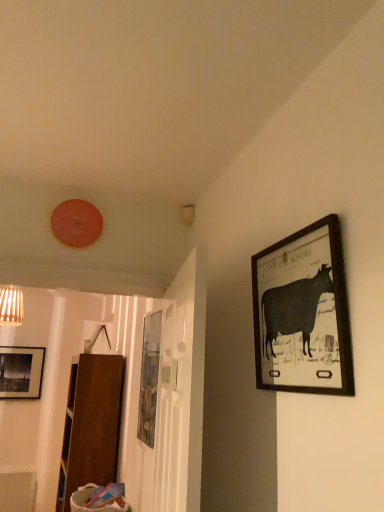
Question: Is matte black picture frame at upper right, the second picture frame from the left, oriented towards matte wooden picture frame at center, the first picture frame positioned from the back?

Choices:
 (A) yes
 (B) no

Answer: (B)

Question: From the image's perspective, is matte black picture frame at upper right, the second picture frame from the left, on top of matte wooden picture frame at center, which is the 2th picture frame from right to left?

Choices:
 (A) yes
 (B) no

Answer: (A)

Question: Considering the relative sizes of matte black picture frame at upper right, marked as the second picture frame in a back-to-front arrangement, and matte wooden picture frame at center, the 2th picture frame from the top, in the image provided, is matte black picture frame at upper right, marked as the second picture frame in a back-to-front arrangement, taller than matte wooden picture frame at center, the 2th picture frame from the top,?

Choices:
 (A) no
 (B) yes

Answer: (A)

Question: Is the position of matte black picture frame at upper right, marked as the second picture frame in a back-to-front arrangement, less distant than that of matte wooden picture frame at center, the first picture frame positioned from the back?

Choices:
 (A) no
 (B) yes

Answer: (B)

Question: From the image's perspective, does matte black picture frame at upper right, positioned as the 1th picture frame in top-to-bottom order, appear lower than matte wooden picture frame at center, which appears as the first picture frame when ordered from the bottom?

Choices:
 (A) yes
 (B) no

Answer: (B)

Question: Does matte black picture frame at upper right, positioned as the 1th picture frame in front-to-back order, have a lesser width compared to matte wooden picture frame at center, the first picture frame in the left-to-right sequence?

Choices:
 (A) no
 (B) yes

Answer: (B)

Question: From a real-world perspective, is matte wooden picture frame at center, which is the 2th picture frame from right to left, under matte black picture frame at upper right, acting as the 1th picture frame starting from the right?

Choices:
 (A) yes
 (B) no

Answer: (A)

Question: Can you confirm if matte wooden picture frame at center, the first picture frame positioned from the back, is shorter than matte black picture frame at upper right, acting as the 1th picture frame starting from the right?

Choices:
 (A) no
 (B) yes

Answer: (A)

Question: Does matte wooden picture frame at center, the 2th picture frame from the top, have a greater width compared to matte black picture frame at upper right, acting as the 1th picture frame starting from the right?

Choices:
 (A) no
 (B) yes

Answer: (B)

Question: Is the depth of matte wooden picture frame at center, which appears as the first picture frame when ordered from the bottom, greater than that of matte black picture frame at upper right, acting as the 1th picture frame starting from the right?

Choices:
 (A) yes
 (B) no

Answer: (A)

Question: Is matte wooden picture frame at center, the first picture frame positioned from the back, looking in the opposite direction of matte black picture frame at upper right, the second picture frame from the left?

Choices:
 (A) yes
 (B) no

Answer: (B)

Question: Is matte wooden picture frame at center, the 2th picture frame from the top, taller than matte black picture frame at upper right, positioned as the 1th picture frame in front-to-back order?

Choices:
 (A) yes
 (B) no

Answer: (A)

Question: Would you say matte wooden picture frame at center, which appears as the first picture frame when ordered from the bottom, is inside or outside matte black picture frame at upper right, positioned as the 1th picture frame in top-to-bottom order?

Choices:
 (A) inside
 (B) outside

Answer: (B)